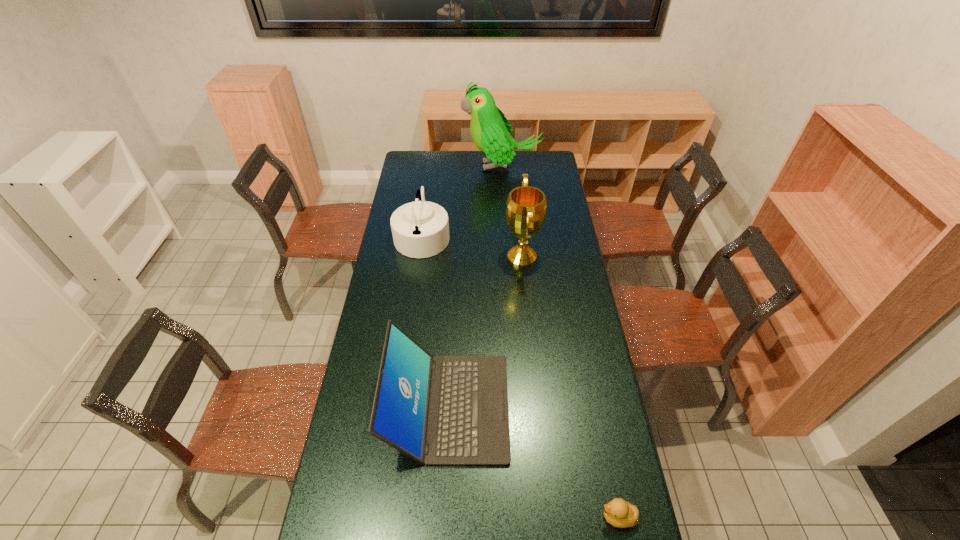
The width and height of the screenshot is (960, 540). I want to click on laptop computer at the left edge, so click(x=448, y=409).

Identify the location of parakeet present at the right edge. (490, 130).

Image resolution: width=960 pixels, height=540 pixels. Identify the location of duckling situated at the right edge. (620, 513).

At what (x,y) coordinates should I click in order to perform the action: click on object at the far right corner. Please return your answer as a coordinate pair (x, y). Image resolution: width=960 pixels, height=540 pixels. Looking at the image, I should click on pyautogui.click(x=490, y=130).

This screenshot has width=960, height=540. In the image, there is a desktop. What are the coordinates of `vacant area at the far edge` in the screenshot? It's located at (520, 158).

You are a GUI agent. You are given a task and a screenshot of the screen. Output one action in this format:
    pyautogui.click(x=<x>, y=<y>)
    Task: Click on the blank space at the left edge
    
    Given the screenshot: What is the action you would take?
    click(385, 484)

In the image, there is a desktop. Identify the location of free space at the right edge. (568, 285).

This screenshot has width=960, height=540. In the image, there is a desktop. In order to click on free space at the far left corner in this screenshot , I will do `click(413, 168)`.

Locate an element on the screen. free space that is in between the kettle and the fourth farthest object is located at coordinates (436, 321).

The image size is (960, 540). I want to click on vacant space that is in between the farthest object and the kettle, so click(x=462, y=201).